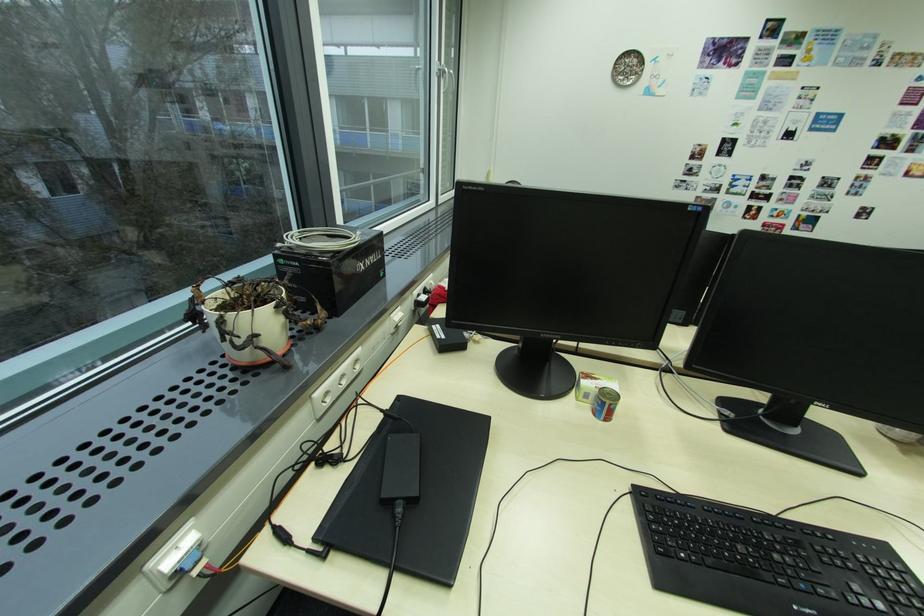
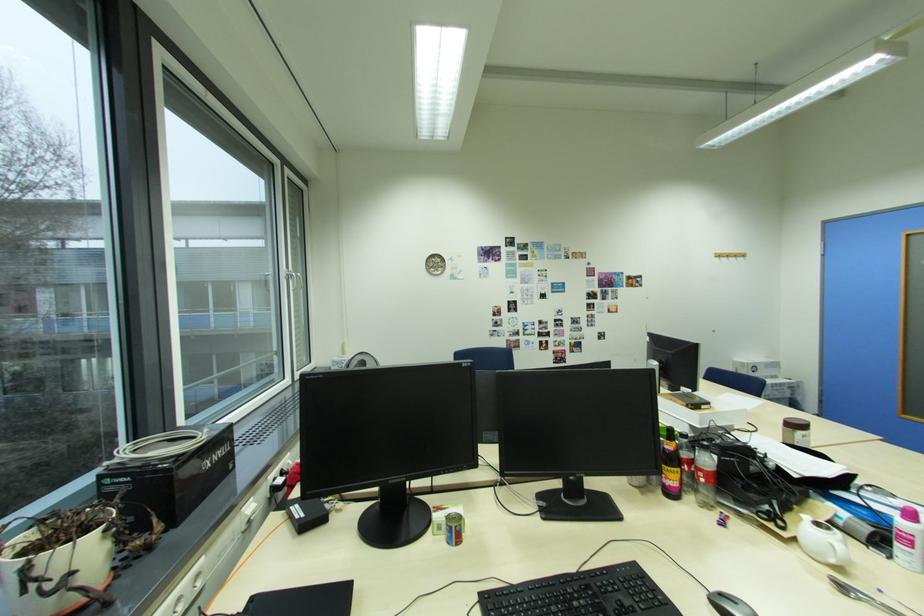
Where in the second image is the point corresponding to the point at 285,313 from the first image?

(112, 539)